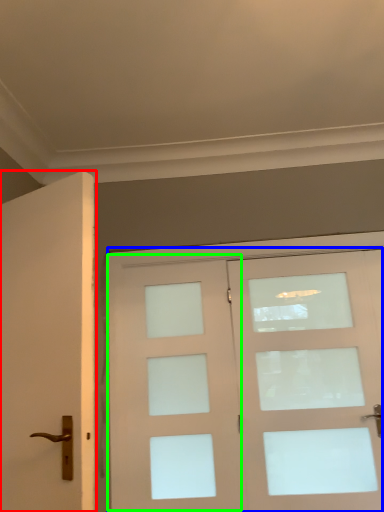
Question: Which is farther away from door (highlighted by a red box)? door (highlighted by a blue box) or screen door (highlighted by a green box)?

Choices:
 (A) door
 (B) screen door

Answer: (A)